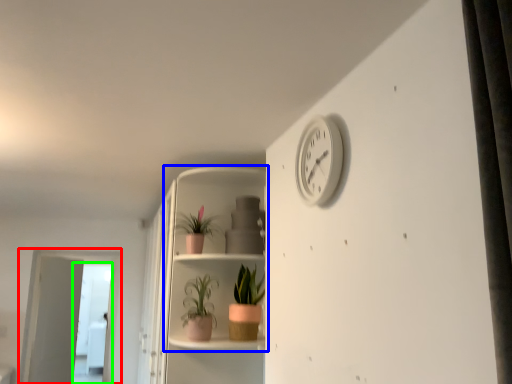
Question: Which object is positioned farthest from screen door (highlighted by a red box)? Select from shelf (highlighted by a blue box) and screen door (highlighted by a green box).

Choices:
 (A) shelf
 (B) screen door

Answer: (A)